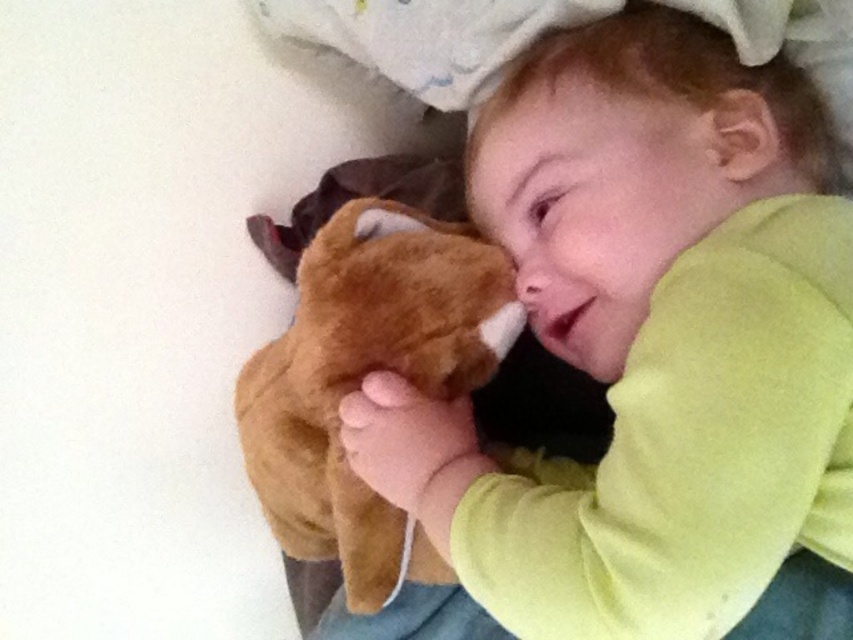
Which is in front, point (850, 244) or point (334, 282)?

Positioned in front is point (850, 244).

Is soft brown plush toy at center to the right of brown plush toy at center from the viewer's perspective?

Correct, you'll find soft brown plush toy at center to the right of brown plush toy at center.

You are a GUI agent. You are given a task and a screenshot of the screen. Output one action in this format:
    pyautogui.click(x=<x>, y=<y>)
    Task: Click on the soft brown plush toy at center
    This screenshot has width=853, height=640.
    Given the screenshot: What is the action you would take?
    pyautogui.click(x=648, y=337)